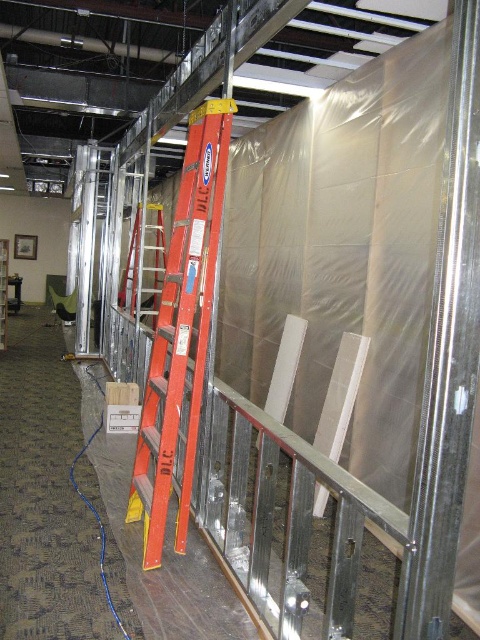
You are standing in a construction area and need to reach a tool located at point (171, 260). The safety regulations state that you must stay at least 10 feet away from any construction zones. Can you safely retrieve the tool without violating the safety rule?

The point (171, 260) is 10.20 feet from the viewer, which is just over the required 10 feet distance. Therefore, you can safely retrieve the tool without violating the safety rule.

You are a construction worker needing to choose a ladder for a task that requires reaching a height of 10 feet. Both the orange aluminum ladder at center and the orange fiberglass ladder at center are available. Which ladder would you select based on their sizes?

The orange fiberglass ladder at center is larger than the orange aluminum ladder at center, so you should choose the orange fiberglass ladder at center to safely reach 10 feet.

You are a construction worker who needs to retrieve a tool from a high shelf that is 2.6 meters away from the orange aluminum ladder at center. Can you reach the tool using the ladder?

The orange aluminum ladder at center and camera are 2.62 meters apart from each other. Since the tool is 2.6 meters away from the ladder, it is within reach as the distance is slightly less than 2.62 meters.